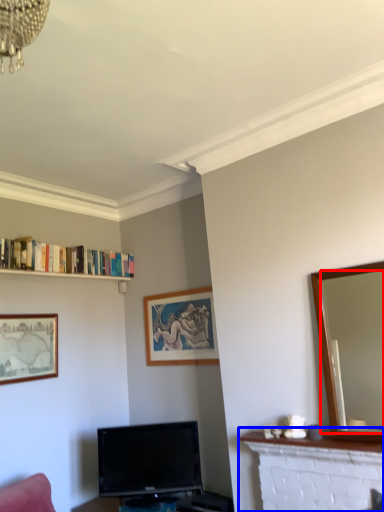
Question: Which point is further to the camera, mirror (highlighted by a red box) or fireplace (highlighted by a blue box)?

Choices:
 (A) mirror
 (B) fireplace

Answer: (B)